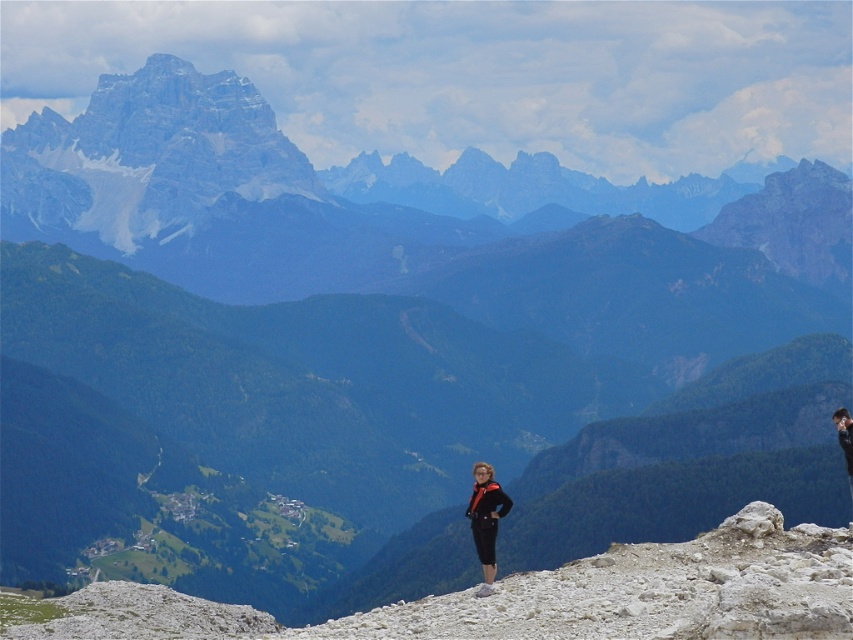
Does point (328, 204) lie behind point (473, 499)?

That is True.

You are a GUI agent. You are given a task and a screenshot of the screen. Output one action in this format:
    pyautogui.click(x=<x>, y=<y>)
    Task: Click on the rocky mountain range at upper left
    
    Given the screenshot: What is the action you would take?
    pyautogui.click(x=254, y=192)